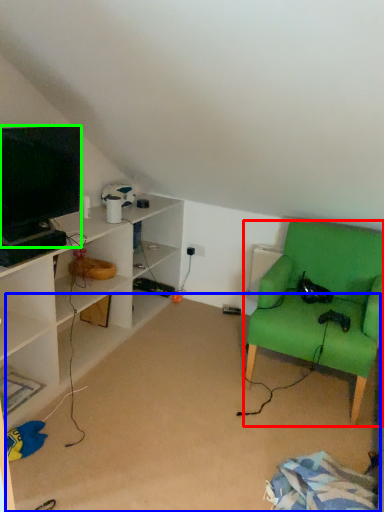
Question: Considering the real-world distances, which object is farthest from chair (highlighted by a red box)? plain (highlighted by a blue box) or television (highlighted by a green box)?

Choices:
 (A) plain
 (B) television

Answer: (B)